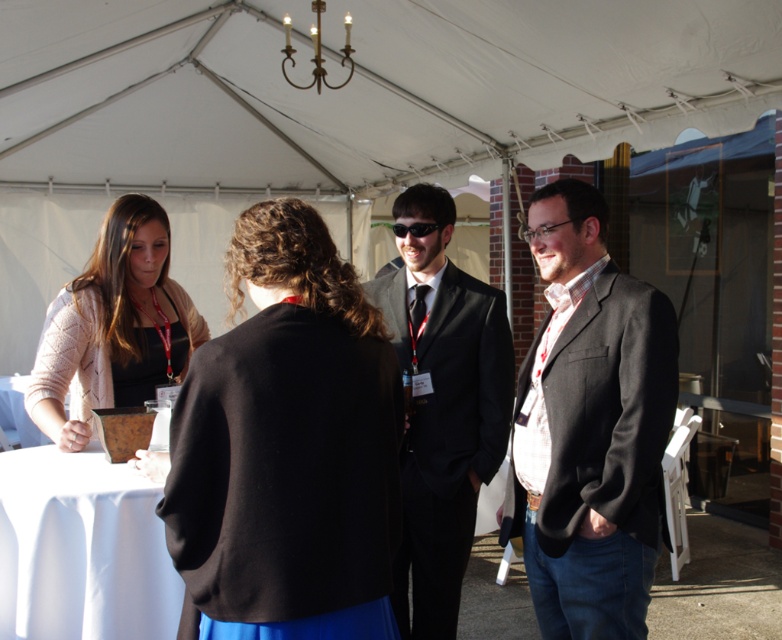
You are organizing a charity event and need to decide which of the two black items, the black wool coat at center or the matte black top at left, can be hung on a narrow coat rack that can only accommodate items with a width of 15 cm. Based on their descriptions, which item is more suitable for the coat rack?

The black wool coat at center is thinner than the matte black top at left, so the black wool coat at center is more suitable for the narrow coat rack since it has a smaller width.

You are at the point marked as point (81,548) in the image. What object is located at that point?

The point (81,548) corresponds to the white cloth at lower left.

You are organizing a photoshoot and need to arrange two items for a fashion spread. You have the black wool coat at center and the matte black top at left. Given their sizes, which item would you place higher on the rack to ensure visibility?

The black wool coat at center is taller than the matte black top at left, so placing it higher on the rack would ensure visibility.